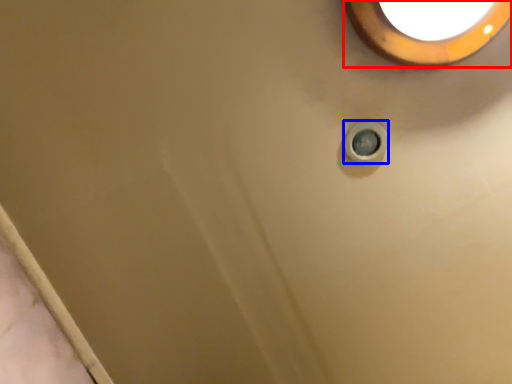
Question: Among these objects, which one is farthest to the camera, lighting (highlighted by a red box) or knob (highlighted by a blue box)?

Choices:
 (A) lighting
 (B) knob

Answer: (B)